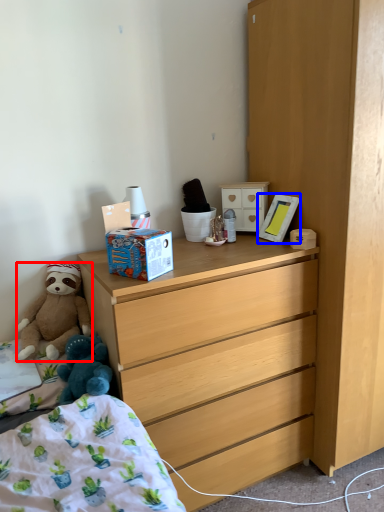
Question: Which object appears closest to the camera in this image, teddy bear (highlighted by a red box) or picture frame (highlighted by a blue box)?

Choices:
 (A) teddy bear
 (B) picture frame

Answer: (A)